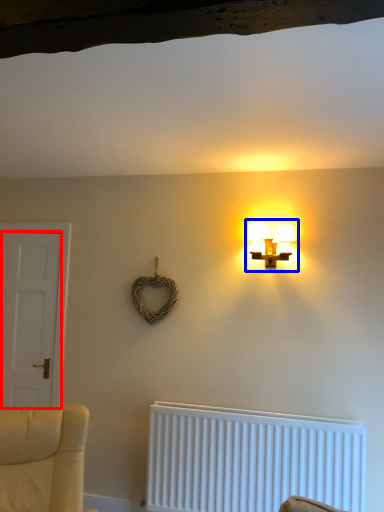
Question: Which object appears farthest to the camera in this image, door (highlighted by a red box) or lamp (highlighted by a blue box)?

Choices:
 (A) door
 (B) lamp

Answer: (A)